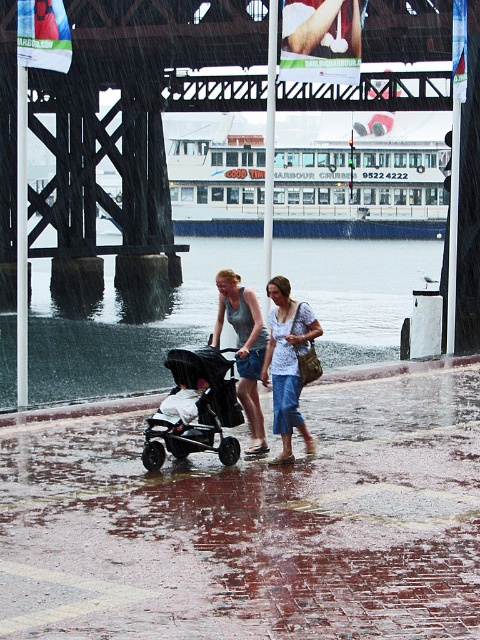
Which is below, black matte stroller at center or denim pants at center?

black matte stroller at center is below.

Can you confirm if black matte stroller at center is positioned below denim pants at center?

Indeed, black matte stroller at center is positioned under denim pants at center.

Which is behind, point (177, 410) or point (300, 384)?

Point (300, 384)

Find the location of `black matte stroller at center`. black matte stroller at center is located at coordinates (194, 408).

Find the location of a particular element. denim pants at center is located at coordinates (288, 362).

Image resolution: width=480 pixels, height=640 pixels. In order to click on denim pants at center in this screenshot , I will do `click(288, 362)`.

Who is taller, wet brick pavement at center or soft gray fabric stroller at center?

With more height is soft gray fabric stroller at center.

Is wet brick pavement at center below soft gray fabric stroller at center?

Yes.

Is point (411, 593) farther from viewer compared to point (179, 394)?

No, (411, 593) is in front of (179, 394).

Locate an element on the screen. The height and width of the screenshot is (640, 480). wet brick pavement at center is located at coordinates (252, 525).